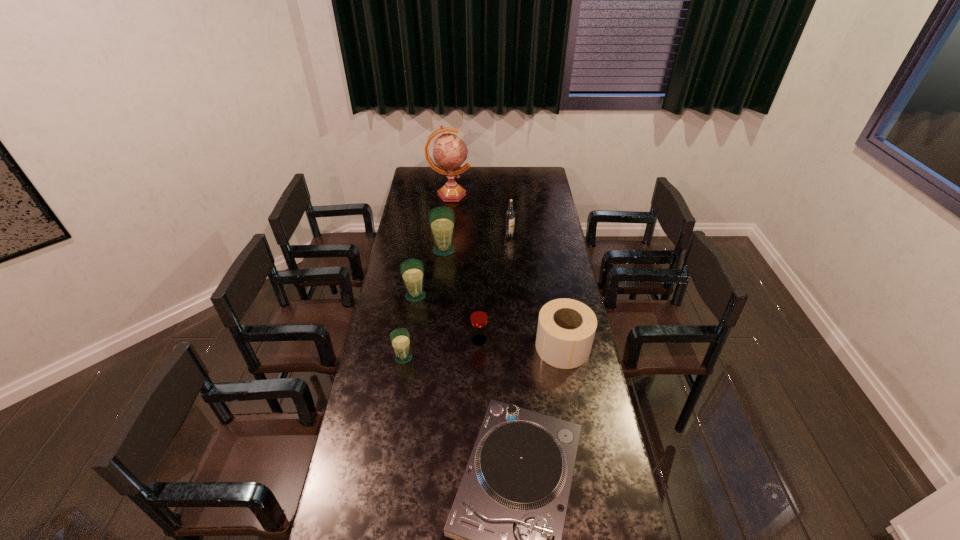
Identify the location of the smallest blue glass. (400, 339).

You are a GUI agent. You are given a task and a screenshot of the screen. Output one action in this format:
    pyautogui.click(x=<x>, y=<y>)
    Task: Click on the nearest blue glass
    
    Given the screenshot: What is the action you would take?
    click(x=400, y=339)

This screenshot has height=540, width=960. I want to click on free space located on the front-facing side of the globe, so click(x=479, y=194).

Locate an element on the screen. vacant point located on the right of the tallest glass is located at coordinates coord(520,250).

You are a GUI agent. You are given a task and a screenshot of the screen. Output one action in this format:
    pyautogui.click(x=<x>, y=<y>)
    Task: Click on the free point located 0.280m on the label of the second farthest object
    Image resolution: width=960 pixels, height=540 pixels.
    Given the screenshot: What is the action you would take?
    pyautogui.click(x=513, y=273)

Image resolution: width=960 pixels, height=540 pixels. Identify the location of free location located on the right of the rightmost glass. (572, 340).

At what (x,y) coordinates should I click in order to perform the action: click on free location located 0.350m on the front of the second biggest blue glass. Please return your answer as a coordinate pair (x, y). Looking at the image, I should click on (404, 368).

What are the coordinates of `vacant space located 0.310m on the front of the toilet tissue` in the screenshot? It's located at (580, 444).

At what (x,y) coordinates should I click in order to perform the action: click on vacant space positioned on the back of the shortest glass. Please return your answer as a coordinate pair (x, y). The height and width of the screenshot is (540, 960). Looking at the image, I should click on (414, 292).

In order to click on globe situated at the left edge in this screenshot , I will do click(x=449, y=152).